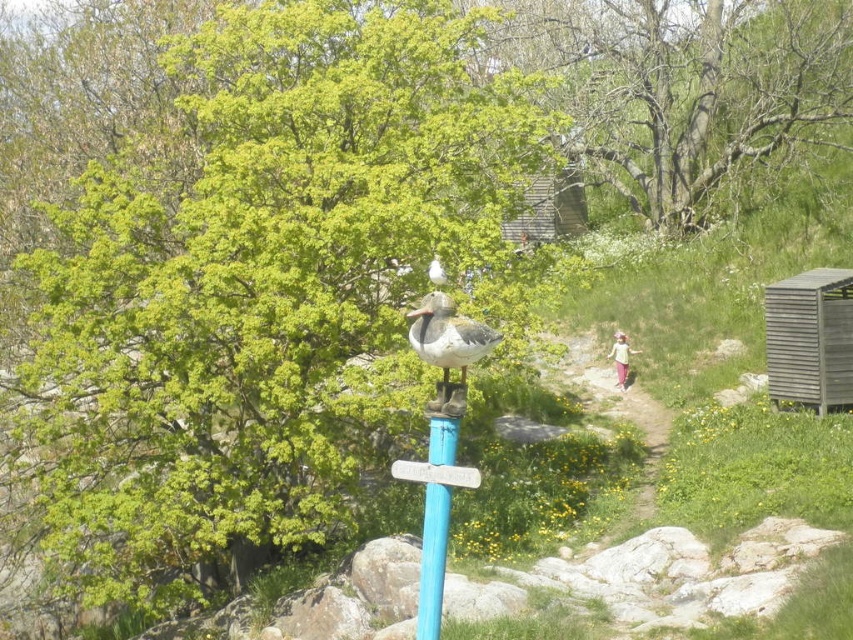
Is matte gray duck at center positioned before white matte duck at center?

Yes.

Who is taller, matte gray duck at center or white matte duck at center?

matte gray duck at center

I want to click on matte gray duck at center, so (x=448, y=348).

The height and width of the screenshot is (640, 853). I want to click on wooden shed at right, so click(x=809, y=339).

Where is `wooden shed at right`? Image resolution: width=853 pixels, height=640 pixels. wooden shed at right is located at coordinates (809, 339).

Is green leafy tree at center above white matte duck at center?

Correct, green leafy tree at center is located above white matte duck at center.

Can you confirm if green leafy tree at center is bigger than white matte duck at center?

Yes.

Does point (372, 326) lie in front of point (444, 280)?

No, (372, 326) is behind (444, 280).

This screenshot has width=853, height=640. Identify the location of green leafy tree at center. (263, 282).